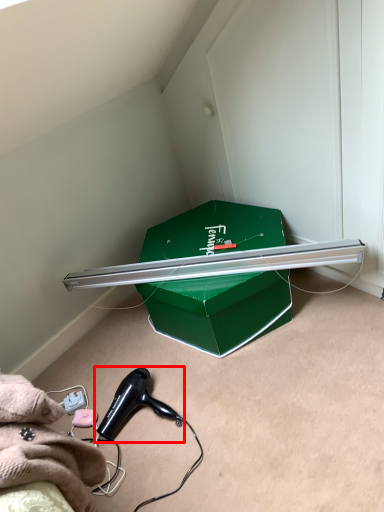
Question: Observing the image, what is the correct spatial positioning of hair drier (annotated by the red box) in reference to box?

Choices:
 (A) right
 (B) left

Answer: (B)